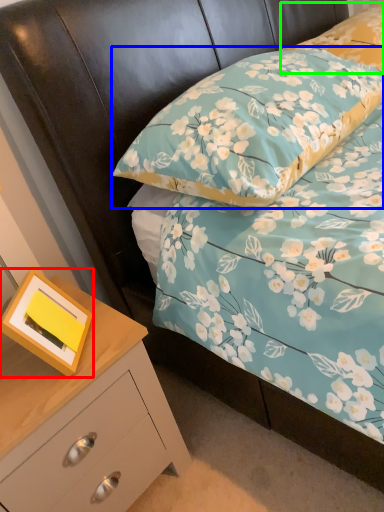
Question: Estimate the real-world distances between objects in this image. Which object is closer to picture frame (highlighted by a red box), pillow (highlighted by a blue box) or pillow (highlighted by a green box)?

Choices:
 (A) pillow
 (B) pillow

Answer: (A)